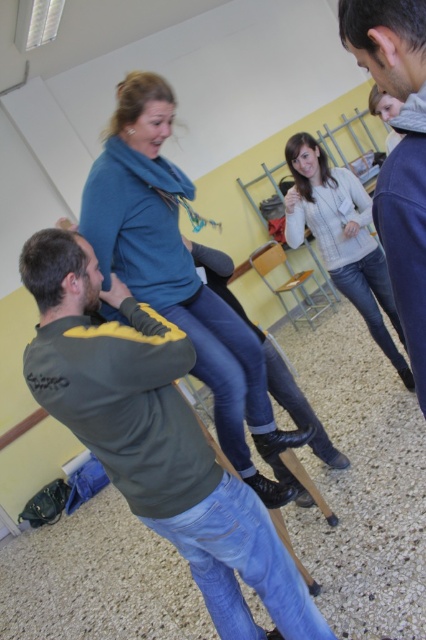
You are standing in the classroom and want to take a photo of the point at coordinates (75, 410). Your camera has a focal length of 50mm and a sensor size of 24mm. What is the minimum distance you need to move forward or backward to ensure the point is within the frame?

The point at coordinates (75, 410) is 1.31 meters from the camera. To ensure it is within the frame, you need to adjust your position so that the camera is at least 1.31 meters away from the point. Since the sensor size and focal length determine the field of view, calculating the exact distance requires using the formula for depth of field or field of view, but based on the given information, maintaining the current distance of 1.31 meters would keep the point in frame.

You are a photographer trying to capture a closeup shot of both the dark green sweatshirt at center and the blue soft scarf at upper center. Given their sizes, which object should you zoom in more on to ensure both are clearly visible in the frame?

The dark green sweatshirt at center is larger than the blue soft scarf at upper center, so you should zoom in more on the blue soft scarf at upper center to balance their sizes in the photo.